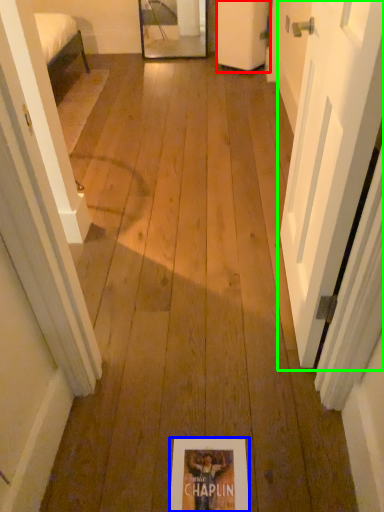
Question: Based on their relative distances, which object is farther from door (highlighted by a red box)? Choose from flyer (highlighted by a blue box) and door (highlighted by a green box).

Choices:
 (A) flyer
 (B) door

Answer: (A)